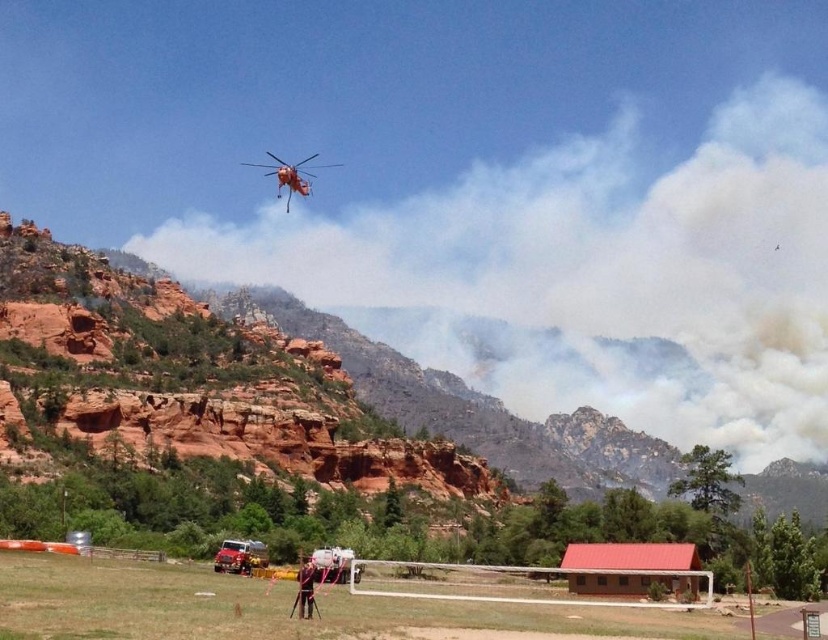
In the scene shown: You are a firefighter in the cabin with a red roof and white trim. You see a point marked at coordinates (291, 176). What object is located at that point?

The point at coordinates (291, 176) indicates the orange matte helicopter at upper center.